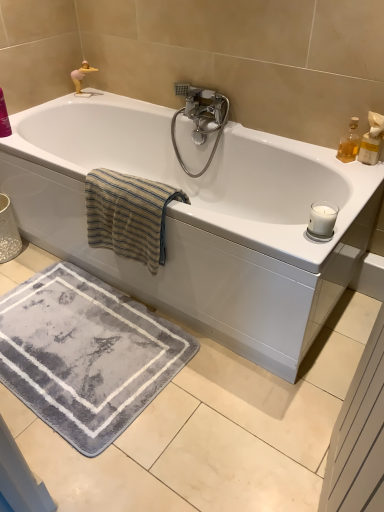
Question: From a real-world perspective, is beige striped towel at upper left physically below polished chrome faucet at upper center?

Choices:
 (A) no
 (B) yes

Answer: (B)

Question: From a real-world perspective, is beige striped towel at upper left located higher than polished chrome faucet at upper center?

Choices:
 (A) no
 (B) yes

Answer: (A)

Question: Can you confirm if beige striped towel at upper left is thinner than polished chrome faucet at upper center?

Choices:
 (A) yes
 (B) no

Answer: (B)

Question: Does beige striped towel at upper left come behind polished chrome faucet at upper center?

Choices:
 (A) yes
 (B) no

Answer: (B)

Question: Is beige striped towel at upper left shorter than polished chrome faucet at upper center?

Choices:
 (A) no
 (B) yes

Answer: (B)

Question: From the image's perspective, is beige striped towel at upper left located beneath polished chrome faucet at upper center?

Choices:
 (A) yes
 (B) no

Answer: (A)

Question: From the image's perspective, does white glossy bathtub at center appear lower than translucent glass bottle at upper right?

Choices:
 (A) yes
 (B) no

Answer: (A)

Question: From the image's perspective, would you say white glossy bathtub at center is positioned over translucent glass bottle at upper right?

Choices:
 (A) yes
 (B) no

Answer: (B)

Question: Could you tell me if white glossy bathtub at center is turned towards translucent glass bottle at upper right?

Choices:
 (A) no
 (B) yes

Answer: (A)

Question: Is white glossy bathtub at center thinner than translucent glass bottle at upper right?

Choices:
 (A) yes
 (B) no

Answer: (B)

Question: Can translucent glass bottle at upper right be found inside white glossy bathtub at center?

Choices:
 (A) yes
 (B) no

Answer: (B)

Question: Can you confirm if white glossy bathtub at center is positioned to the right of translucent glass bottle at upper right?

Choices:
 (A) no
 (B) yes

Answer: (A)

Question: Is there a large distance between polished chrome faucet at upper center and translucent glass bottle at upper right?

Choices:
 (A) yes
 (B) no

Answer: (B)